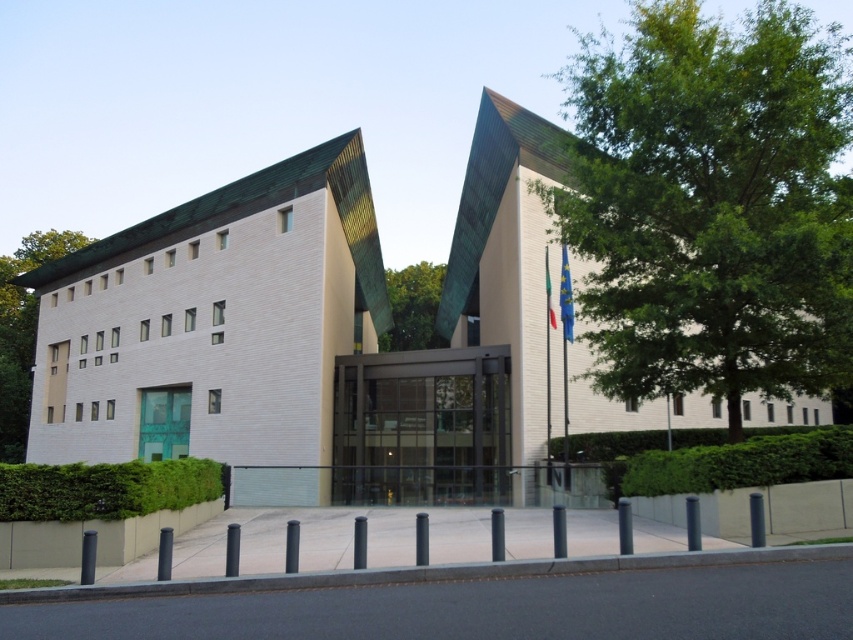
Between point (7, 333) and point (407, 296), which one is positioned in front?

Point (7, 333) is more forward.

Is green leafy tree at upper left shorter than green leafy tree at center?

No.

Between point (16, 458) and point (437, 342), which one is positioned in front?

Point (16, 458) is more forward.

This screenshot has width=853, height=640. In order to click on green leafy tree at upper left in this screenshot , I will do `click(22, 332)`.

Which of these two, green leafy tree at upper right or green leafy tree at upper left, stands taller?

Standing taller between the two is green leafy tree at upper right.

Is green leafy tree at upper right shorter than green leafy tree at upper left?

No.

In order to click on green leafy tree at upper right in this screenshot , I will do `click(712, 204)`.

Identify the location of green leafy tree at upper right. The image size is (853, 640). (712, 204).

Looking at this image, is green leafy tree at upper right thinner than green leafy tree at center?

No, green leafy tree at upper right is not thinner than green leafy tree at center.

Which is behind, point (637, 387) or point (427, 333)?

Positioned behind is point (427, 333).

Where is `green leafy tree at upper right`? The image size is (853, 640). green leafy tree at upper right is located at coordinates (712, 204).